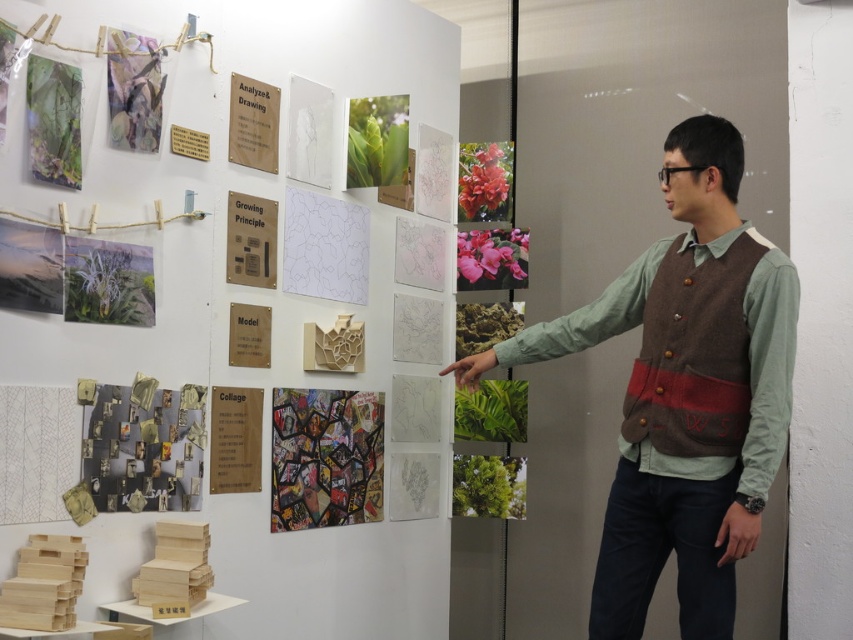
Question: Which point appears farthest from the camera in this image?

Choices:
 (A) (457, 456)
 (B) (155, 86)
 (C) (128, 454)

Answer: (A)

Question: Which point is closer to the camera taking this photo?

Choices:
 (A) (33, 173)
 (B) (489, 234)

Answer: (A)

Question: Is green wool vest at center further to the viewer compared to green matte plant at center?

Choices:
 (A) yes
 (B) no

Answer: (B)

Question: Is recycled paper collage at lower left further to camera compared to green matte paper at left?

Choices:
 (A) no
 (B) yes

Answer: (A)

Question: Which point appears closest to the camera in this image?

Choices:
 (A) (727, 145)
 (B) (90, 275)

Answer: (A)

Question: Can you confirm if recycled paper collage at lower left is wider than green leafy plant at upper left?

Choices:
 (A) yes
 (B) no

Answer: (A)